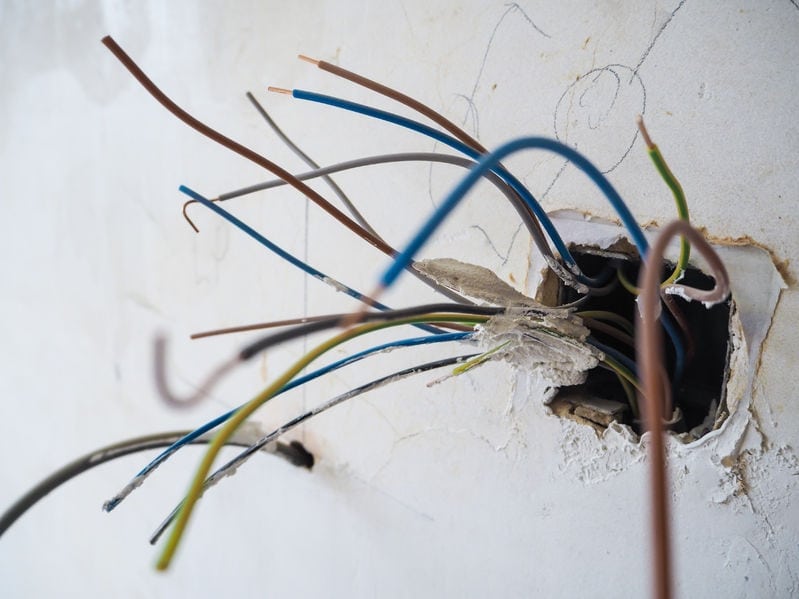
The height and width of the screenshot is (599, 799). Find the location of `exposed wire tips`. exposed wire tips is located at coordinates (284, 87), (307, 59), (184, 211), (360, 305), (642, 130).